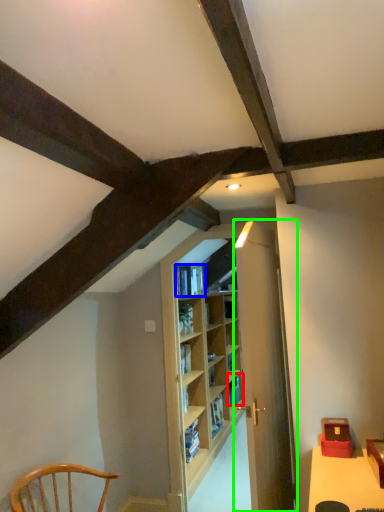
Question: Considering the real-world distances, which object is closest to book (highlighted by a red box)? book (highlighted by a blue box) or door (highlighted by a green box).

Choices:
 (A) book
 (B) door

Answer: (A)